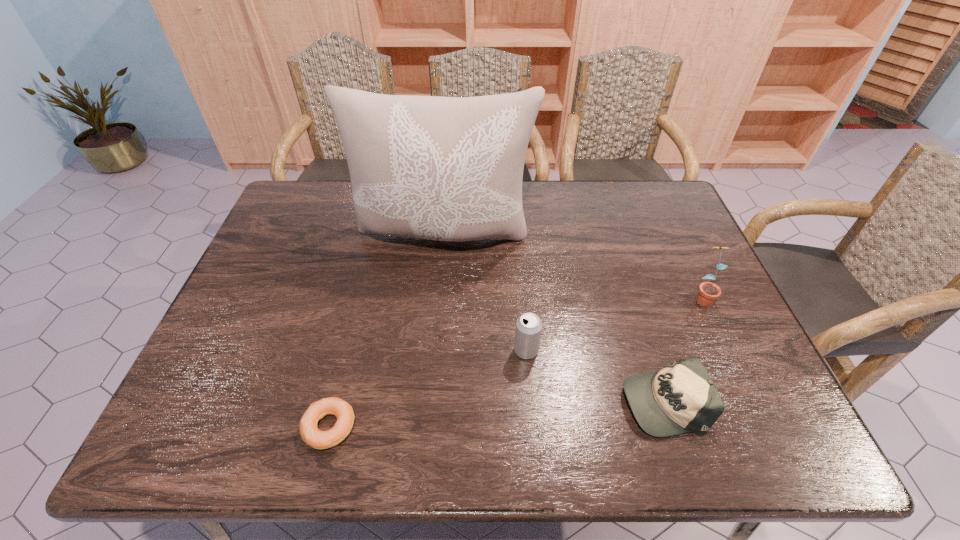
Identify the location of the farthest object. (450, 169).

This screenshot has height=540, width=960. I want to click on cushion, so click(450, 169).

You are a GUI agent. You are given a task and a screenshot of the screen. Output one action in this format:
    pyautogui.click(x=<x>, y=<y>)
    Task: Click on the fourth shortest object
    This screenshot has height=540, width=960.
    Given the screenshot: What is the action you would take?
    pyautogui.click(x=708, y=292)

You are a GUI agent. You are given a task and a screenshot of the screen. Output one action in this format:
    pyautogui.click(x=<x>, y=<y>)
    Task: Click on the rightmost object
    The width and height of the screenshot is (960, 540).
    Given the screenshot: What is the action you would take?
    pyautogui.click(x=708, y=292)

Where is `the third nearest object`? the third nearest object is located at coordinates (528, 326).

Identify the location of the third shortest object. (528, 326).

The height and width of the screenshot is (540, 960). I want to click on the fourth tallest object, so click(x=680, y=398).

Find the location of `the second object from right to left`. the second object from right to left is located at coordinates (680, 398).

Locate an element on the screen. the shortest object is located at coordinates (311, 435).

At what (x,y) coordinates should I click in order to perform the action: click on vacant space located on the front side of the cushion. Please return your answer as a coordinate pair (x, y). The height and width of the screenshot is (540, 960). Looking at the image, I should click on (437, 327).